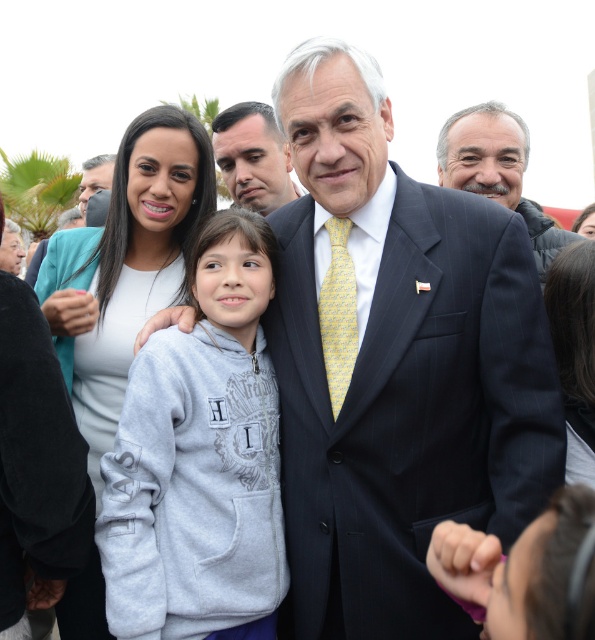
Does gray fleece hoodie at center have a greater width compared to dark gray suit at center?

No, gray fleece hoodie at center is not wider than dark gray suit at center.

Is gray fleece hoodie at center positioned in front of dark gray suit at center?

Yes, gray fleece hoodie at center is in front of dark gray suit at center.

Is point (224, 428) closer to viewer compared to point (458, 170)?

That is True.

The image size is (595, 640). Find the location of `gray fleece hoodie at center`. gray fleece hoodie at center is located at coordinates (199, 460).

Between point (245, 116) and point (355, 352), which one is positioned behind?

Point (245, 116)

Is smooth skin face at center bigger than yellow printed tie at center?

Yes.

The image size is (595, 640). I want to click on smooth skin face at center, so click(x=252, y=156).

The image size is (595, 640). Identify the location of dark gray suit at center. (496, 170).

Is point (500, 164) closer to viewer compared to point (267, 212)?

Yes.

Is point (549, 230) behind point (217, 140)?

No, (549, 230) is closer to viewer.

Where is `dark gray suit at center`? The image size is (595, 640). dark gray suit at center is located at coordinates pos(496,170).